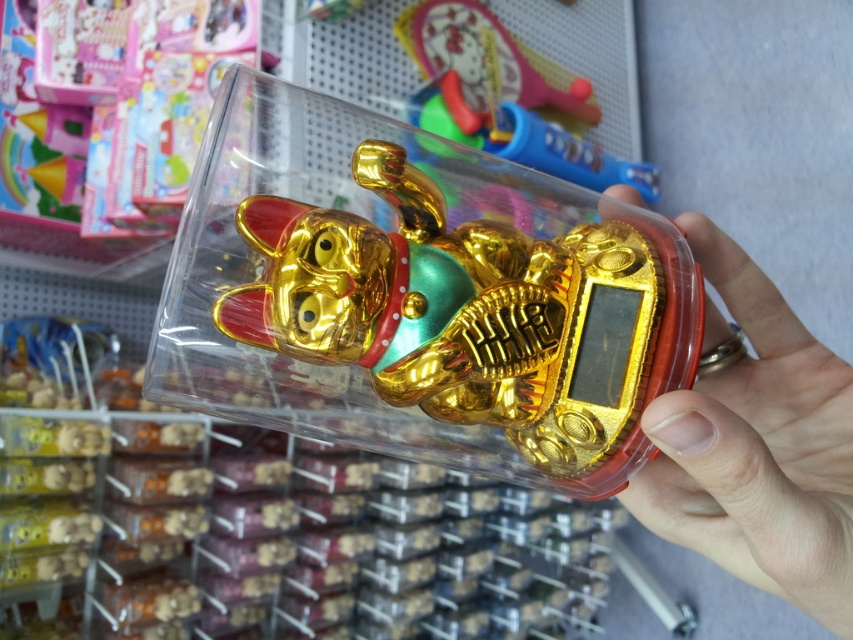
Question: Does gold shiny lucky cat at center have a greater width compared to gold metallic hand at center?

Choices:
 (A) no
 (B) yes

Answer: (B)

Question: Which of the following is the farthest from the observer?

Choices:
 (A) gold metallic hand at center
 (B) gold shiny lucky cat at center

Answer: (B)

Question: In this image, where is gold shiny lucky cat at center located relative to gold metallic hand at center?

Choices:
 (A) below
 (B) above

Answer: (B)

Question: Which point appears farthest from the camera in this image?

Choices:
 (A) (250, 205)
 (B) (778, 349)

Answer: (B)

Question: Can you confirm if gold shiny lucky cat at center is thinner than gold metallic hand at center?

Choices:
 (A) yes
 (B) no

Answer: (B)

Question: Among these points, which one is farthest from the camera?

Choices:
 (A) [451, 413]
 (B) [709, 449]

Answer: (A)